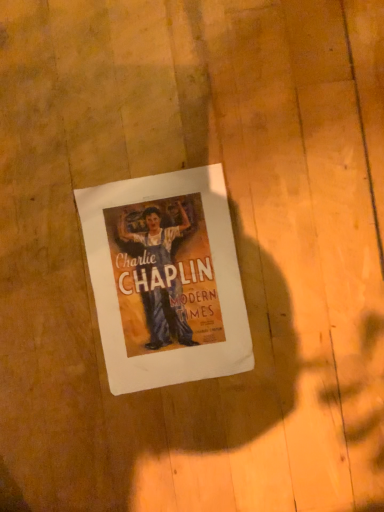
The width and height of the screenshot is (384, 512). Describe the element at coordinates (165, 279) in the screenshot. I see `white paper poster at center` at that location.

What is the approximate height of white paper poster at center?

white paper poster at center is 0.39 inches tall.

In order to click on white paper poster at center in this screenshot , I will do `click(165, 279)`.

Find the location of a particular element. This screenshot has width=384, height=512. white paper poster at center is located at coordinates (165, 279).